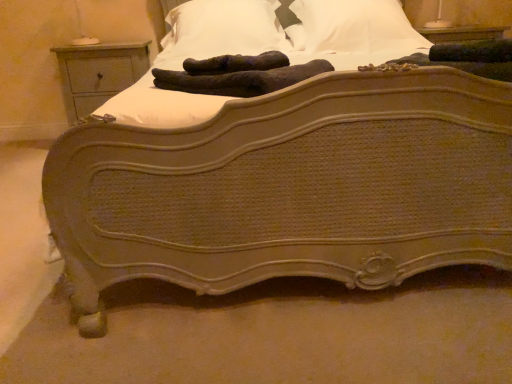
Question: In the image, is light gray wood nightstand at left on the left side or the right side of brown fuzzy gloves at center?

Choices:
 (A) right
 (B) left

Answer: (B)

Question: From the image's perspective, relative to brown fuzzy gloves at center, is light gray wood nightstand at left above or below?

Choices:
 (A) below
 (B) above

Answer: (B)

Question: Considering the real-world distances, which object is farthest from the light gray wood nightstand at left?

Choices:
 (A) white soft pillow at upper center, which ranks as the second pillow in left-to-right order
 (B) white soft pillow at upper center, acting as the first pillow starting from the left
 (C) brown fuzzy gloves at center

Answer: (C)

Question: Based on their relative distances, which object is nearer to the white soft pillow at upper center, which is the 2th pillow from right to left?

Choices:
 (A) brown fuzzy gloves at center
 (B) white soft pillow at upper center, the first pillow positioned from the right
 (C) light gray wood nightstand at left

Answer: (B)